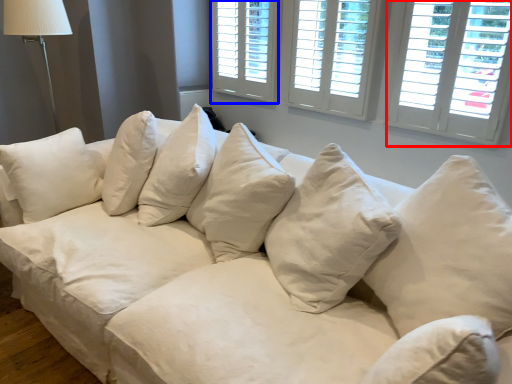
Question: Which of the following is the closest to the observer, window (highlighted by a red box) or window (highlighted by a blue box)?

Choices:
 (A) window
 (B) window

Answer: (A)